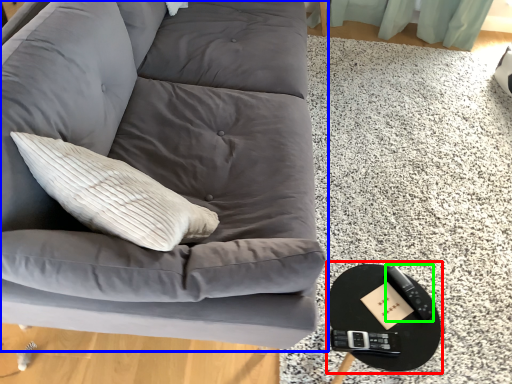
Question: Which object is the farthest from round table (highlighted by a red box)? Choose among these: studio couch (highlighted by a blue box) or remote (highlighted by a green box).

Choices:
 (A) studio couch
 (B) remote

Answer: (A)